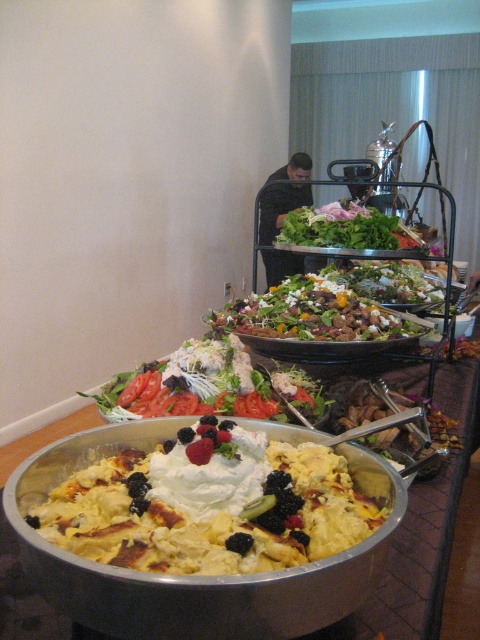
You are a guest at a buffet and want to serve yourself a meal. You see the metallic silver bowl at center and the fresh green salad at center. Which dish should you reach for first if you want to grab the salad first?

The fresh green salad at center is on the left side of the metallic silver bowl at center. Since you want to grab the salad first, you should reach for the fresh green salad at center before the metallic silver bowl at center.